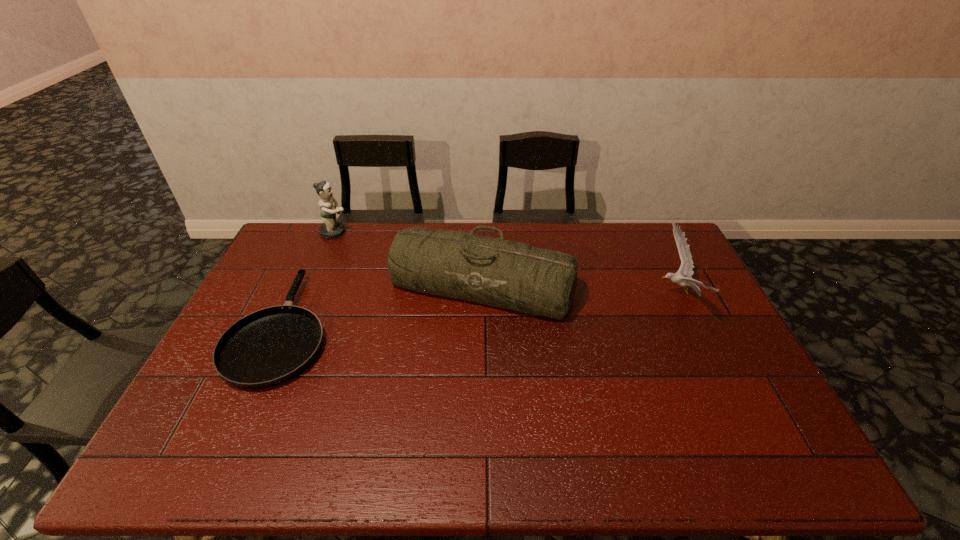
Image resolution: width=960 pixels, height=540 pixels. Identify the location of the second closest object to the third object from left to right. (330, 229).

You are a GUI agent. You are given a task and a screenshot of the screen. Output one action in this format:
    pyautogui.click(x=<x>, y=<y>)
    Task: Click on the object that is the third nearest to the rightmost object
    The height and width of the screenshot is (540, 960).
    Given the screenshot: What is the action you would take?
    pyautogui.click(x=330, y=229)

What are the coordinates of `vacant region that satisfies the following two spatial constraints: 1. on the front-facing side of the farthest object; 2. on the left side of the duffel bag` in the screenshot? It's located at (312, 286).

What are the coordinates of `vacant space that satisfies the following two spatial constraints: 1. on the front-facing side of the figurine; 2. on the back side of the third object from left to right` in the screenshot? It's located at (312, 286).

Where is `vacant space that satisfies the following two spatial constraints: 1. on the handle side of the shortest object; 2. on the left side of the third object from left to right`? vacant space that satisfies the following two spatial constraints: 1. on the handle side of the shortest object; 2. on the left side of the third object from left to right is located at coordinates (302, 286).

Locate an element on the screen. free point that satisfies the following two spatial constraints: 1. on the front-facing side of the farthest object; 2. on the right side of the duffel bag is located at coordinates (312, 286).

What are the coordinates of `free space that satisfies the following two spatial constraints: 1. on the handle side of the third object from left to right; 2. on the right side of the frying pan` in the screenshot? It's located at (302, 286).